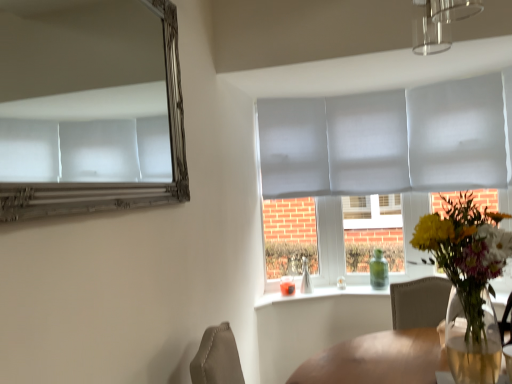
Question: Looking at their shapes, would you say translucent glass vase at center is wider or thinner than matte gray glass door at center?

Choices:
 (A) thin
 (B) wide

Answer: (B)

Question: Is point (458, 289) positioned closer to the camera than point (360, 145)?

Choices:
 (A) closer
 (B) farther

Answer: (A)

Question: Which object is the closest to the matte gray glass door at center?

Choices:
 (A) silver metallic mirror at upper left
 (B) green glass bottle at window
 (C) translucent glass vase at window
 (D) translucent glass vase at center

Answer: (B)

Question: Which object is the closest to the matte gray glass door at center?

Choices:
 (A) green glass bottle at window
 (B) translucent glass vase at window
 (C) silver metallic mirror at upper left
 (D) translucent glass vase at center

Answer: (A)